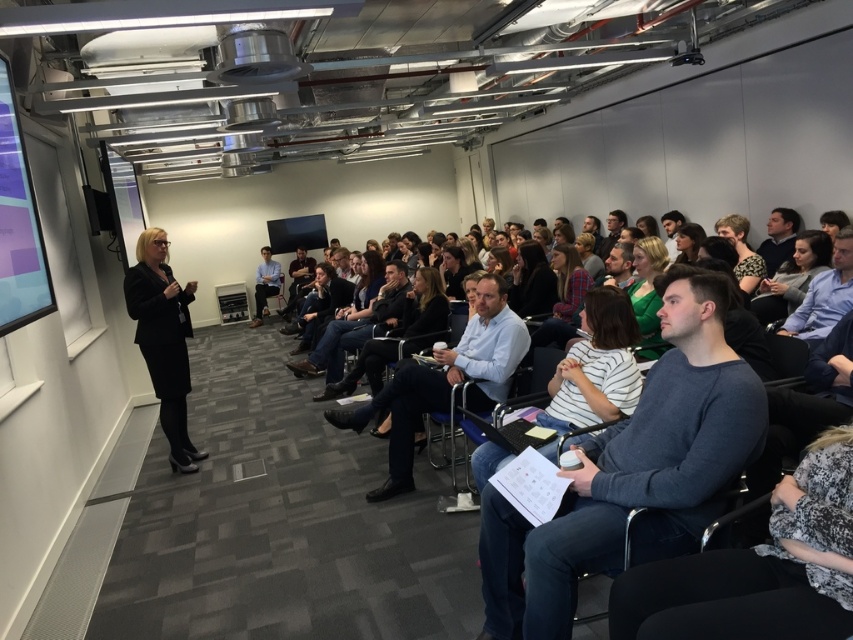
You are a photographer in the back of the room and want to take a photo of the gray sweater at center and striped cotton shirt at center. Which one will appear larger in the photo?

The gray sweater at center will appear larger in the photo because it is taller than the striped cotton shirt at center.

You are organizing a small event and need to ensure that two attendees, one wearing a gray sweater at center and another in a black suit at center, can comfortably sit side by side in a row of chairs. Each chair occupies 0.5 meters of space. What is the minimum length of the row required to accommodate both attendees?

The gray sweater at center and black suit at center are 3.36 meters apart. To accommodate both attendees sitting side by side, the row needs to be at least 1 meter long since each chair takes up 0.5 meters. However, the existing distance between them is 3.36 meters, so the row length should be at least 3.36 meters to maintain their current spacing.